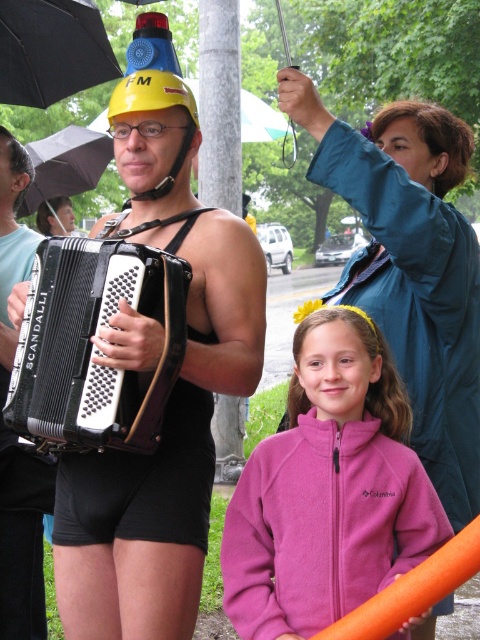
Which is in front, point (154, 300) or point (9, 204)?

Positioned in front is point (154, 300).

Is black matte accordion at center shorter than matte black accordion at center?

Indeed, black matte accordion at center has a lesser height compared to matte black accordion at center.

Locate an element on the screen. The image size is (480, 640). black matte accordion at center is located at coordinates (95, 348).

Consider the image. Is pink fleece jacket at lower center below matte black swimsuit at center?

Indeed, pink fleece jacket at lower center is positioned under matte black swimsuit at center.

Does pink fleece jacket at lower center appear on the left side of matte black swimsuit at center?

Incorrect, pink fleece jacket at lower center is not on the left side of matte black swimsuit at center.

Locate an element on the screen. pink fleece jacket at lower center is located at coordinates (328, 490).

Is point (361, 204) in front of point (43, 156)?

Yes, point (361, 204) is closer to viewer.

Can you confirm if teal fabric jacket at upper right is bigger than black fabric umbrella at upper left?

No, teal fabric jacket at upper right is not bigger than black fabric umbrella at upper left.

Is point (417, 280) farther from viewer compared to point (109, 138)?

No, (417, 280) is closer to viewer.

Locate an element on the screen. The height and width of the screenshot is (640, 480). teal fabric jacket at upper right is located at coordinates (410, 268).